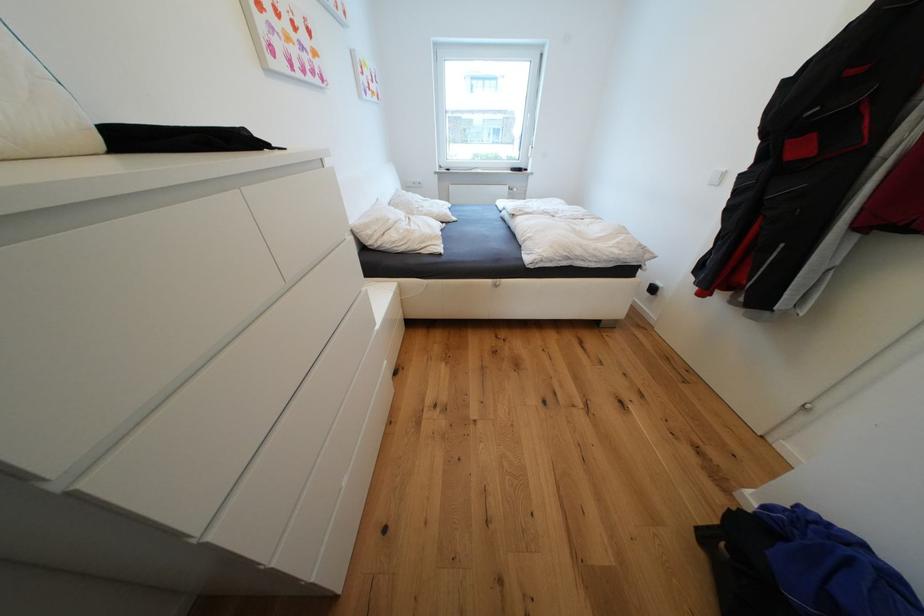
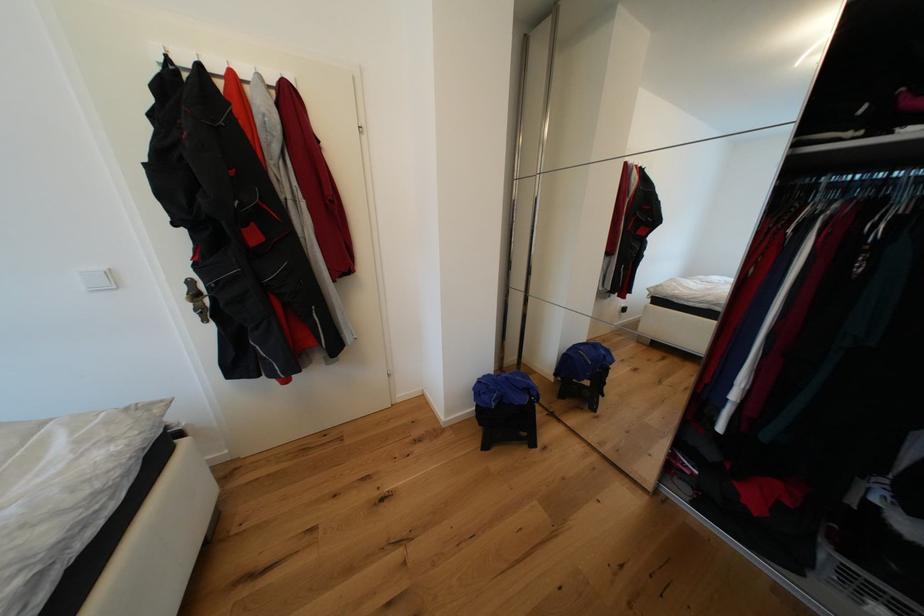
How did the camera likely rotate?

The camera rotated toward right-down.